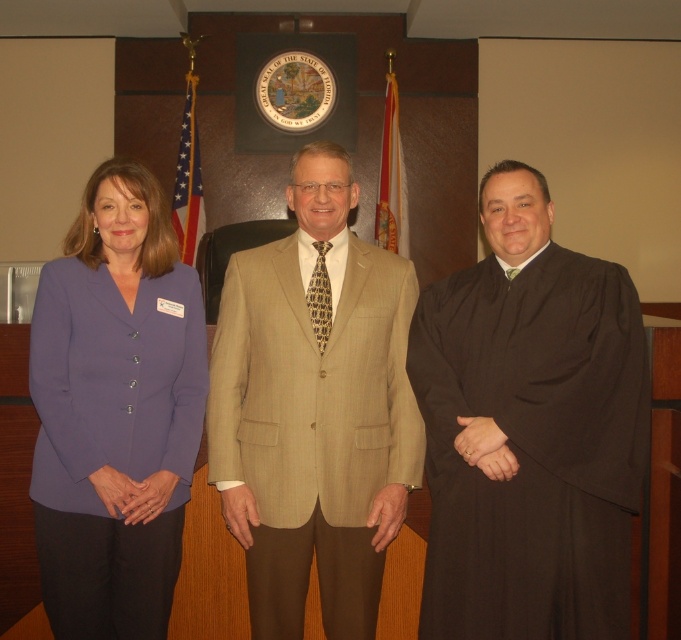
Question: Is black matte robe at right to the right of tan pinstripe suit at center from the viewer's perspective?

Choices:
 (A) yes
 (B) no

Answer: (A)

Question: Which is nearer to the black matte robe at right?

Choices:
 (A) purple fabric blazer at left
 (B) tan pinstripe suit at center

Answer: (B)

Question: Which point appears farthest from the camera in this image?

Choices:
 (A) (63, 273)
 (B) (375, 604)

Answer: (B)

Question: Is tan pinstripe suit at center bigger than purple fabric blazer at left?

Choices:
 (A) no
 (B) yes

Answer: (B)

Question: Which point is farther to the camera?

Choices:
 (A) (347, 604)
 (B) (104, 403)
 (C) (471, 614)

Answer: (A)

Question: Can you confirm if tan pinstripe suit at center is positioned to the right of purple fabric blazer at left?

Choices:
 (A) no
 (B) yes

Answer: (B)